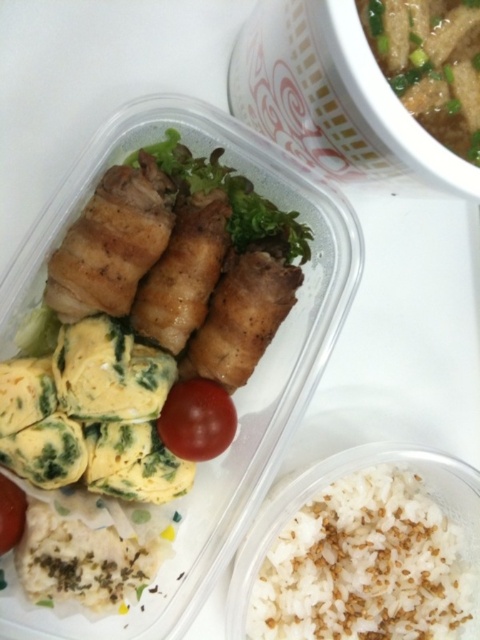
You have two tomatoes in your bento box. The glossy red tomato at center and the red matte tomato at lower left. Which one is wider?

The glossy red tomato at center is wider than the red matte tomato at lower left.

You are a food critic evaluating the presentation of this meal. You notice two items at the center of the container. Which one has a greater width between the green leafy vegetable at center and the glossy red tomato at center?

The green leafy vegetable at center has a greater width than the glossy red tomato at center.